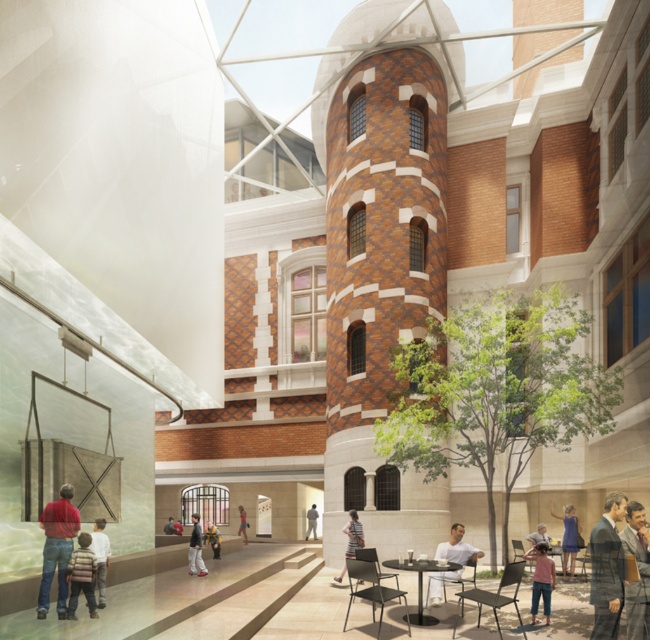
You are standing in the modern architectural space described. You see the dark blue jeans at center and the light brown leather jacket at lower right. Which object is closer to the ground?

The dark blue jeans at center is positioned under the light brown leather jacket at lower right, so it is closer to the ground.

You are an interior designer planning to place a new sofa in the space. The sofa requires a minimum of 2 meters of width to fit comfortably. You see the black glossy table at center and the gray fabric at center. Which object can accommodate the sofa next to it based on their widths?

The black glossy table at center has a larger width than the gray fabric at center, so the sofa can be placed next to the black glossy table at center as it provides sufficient space.

You are standing in front of a modern architectural space with a tall brick tower. You notice a striped fabric shirt at center and a light brown leather jacket at center. Which clothing item is positioned higher?

The striped fabric shirt at center is located above the light brown leather jacket at center, so it is positioned higher.